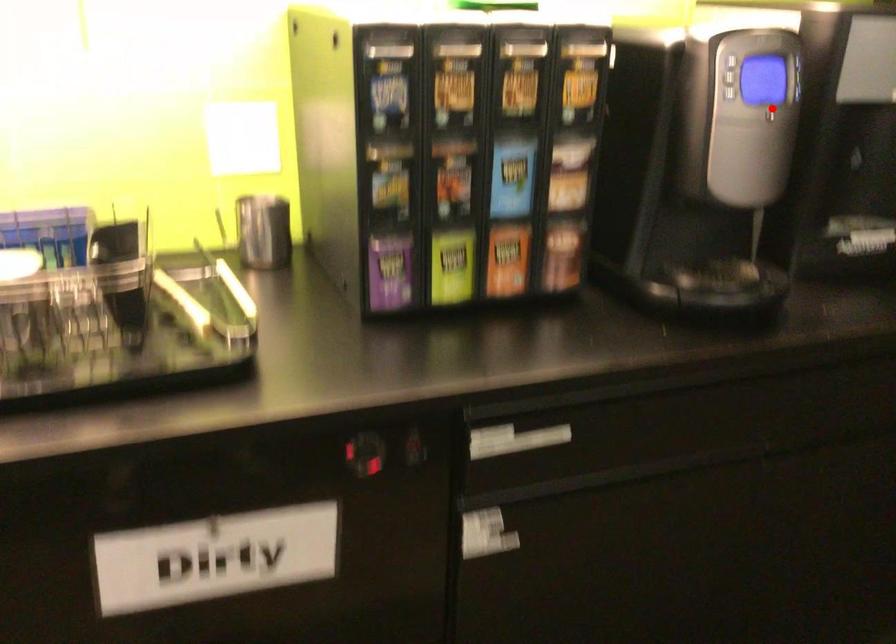
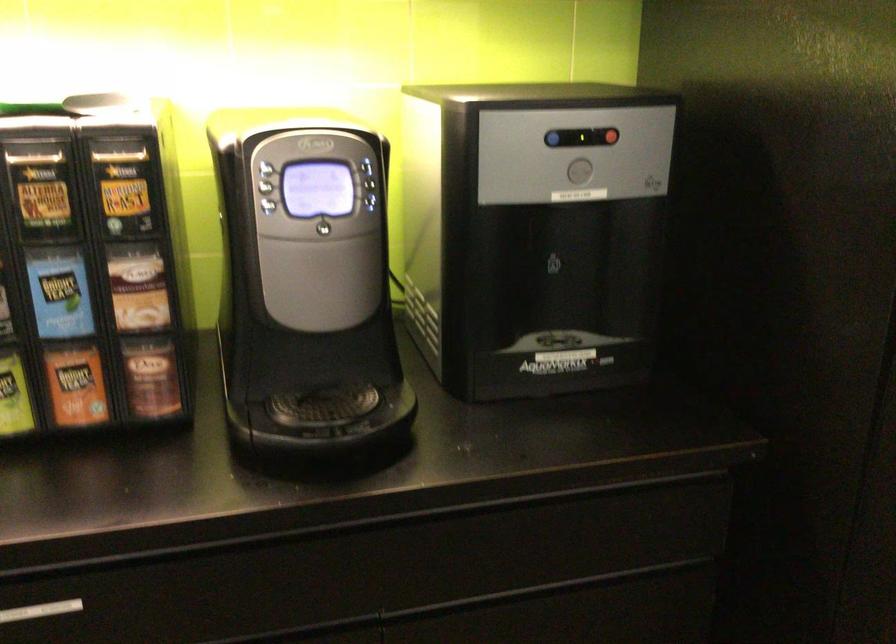
Question: I am providing you with two images of the same scene from different viewpoints. In image1, a red point is highlighted. Considering the same 3D point in image2, which of the following is correct?

Choices:
 (A) It is closer
 (B) It is farther

Answer: (A)